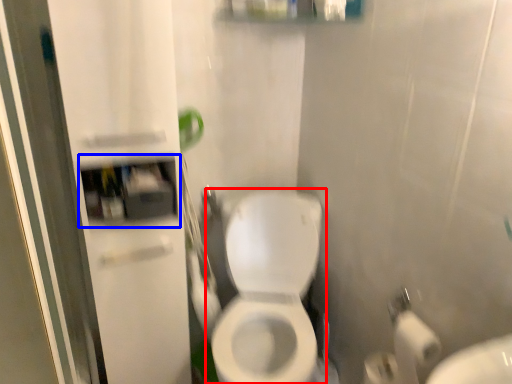
Question: Among these objects, which one is farthest to the camera, toilet (highlighted by a red box) or medicine cabinet (highlighted by a blue box)?

Choices:
 (A) toilet
 (B) medicine cabinet

Answer: (B)